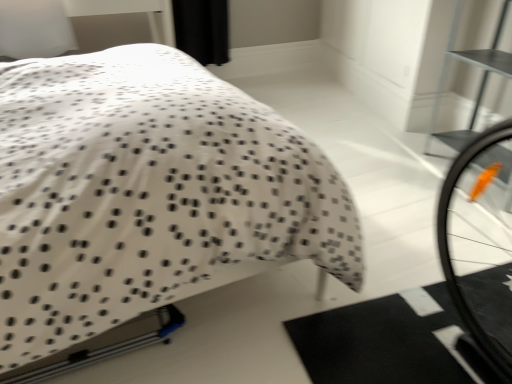
Question: From the image's perspective, is white dotted fabric bed at center located above or below metallic silver bookshelf at upper right?

Choices:
 (A) below
 (B) above

Answer: (A)

Question: Considering the relative positions of white dotted fabric bed at center and metallic silver bookshelf at upper right in the image provided, is white dotted fabric bed at center to the left or to the right of metallic silver bookshelf at upper right?

Choices:
 (A) right
 (B) left

Answer: (B)

Question: Considering the positions of white dotted fabric bed at center and metallic silver bookshelf at upper right in the image, is white dotted fabric bed at center bigger or smaller than metallic silver bookshelf at upper right?

Choices:
 (A) small
 (B) big

Answer: (B)

Question: In terms of width, does metallic silver bookshelf at upper right look wider or thinner when compared to white dotted fabric bed at center?

Choices:
 (A) thin
 (B) wide

Answer: (A)

Question: Is metallic silver bookshelf at upper right taller or shorter than white dotted fabric bed at center?

Choices:
 (A) short
 (B) tall

Answer: (A)

Question: Considering their positions, is metallic silver bookshelf at upper right located in front of or behind white dotted fabric bed at center?

Choices:
 (A) front
 (B) behind

Answer: (B)

Question: From a real-world perspective, is metallic silver bookshelf at upper right above or below white dotted fabric bed at center?

Choices:
 (A) below
 (B) above

Answer: (A)